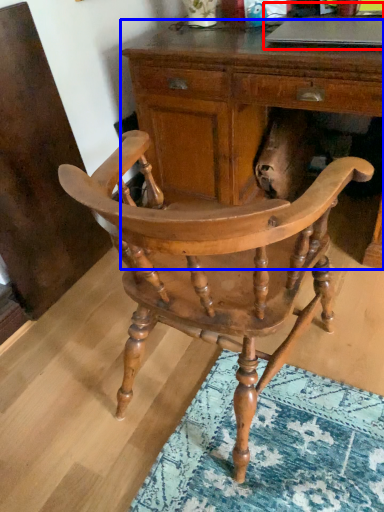
Question: Which point is further to the camera, computer (highlighted by a red box) or desk (highlighted by a blue box)?

Choices:
 (A) computer
 (B) desk

Answer: (A)